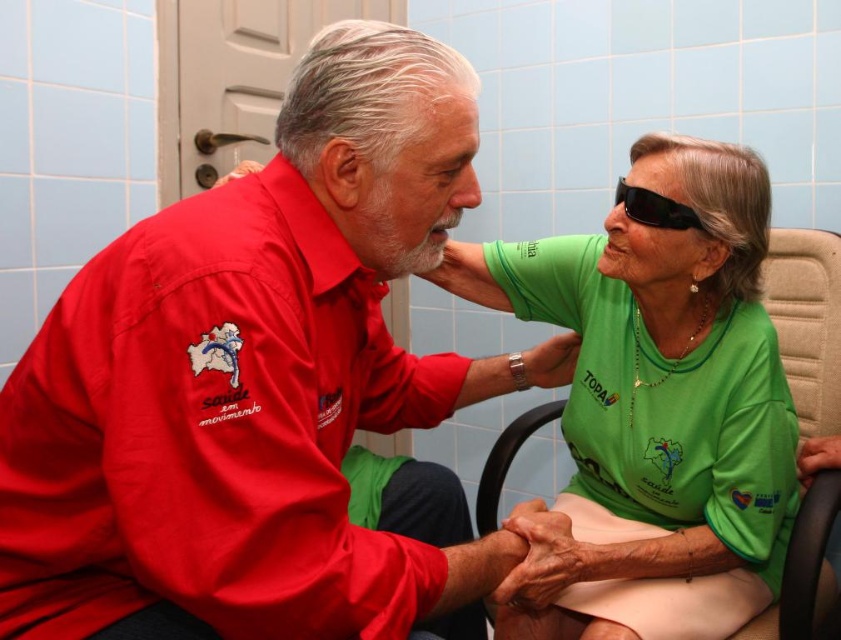
Is matte red shirt at center further to camera compared to green fabric shirt at center?

No, it is in front of green fabric shirt at center.

Who is lower down, matte red shirt at center or green fabric shirt at center?

green fabric shirt at center is below.

Is point (130, 401) in front of point (538, 266)?

Yes.

Find the location of a particular element. matte red shirt at center is located at coordinates (260, 387).

Who is positioned more to the right, matte red shirt at center or black matte forehead at upper center?

Positioned to the right is black matte forehead at upper center.

Who is more forward, (252, 451) or (665, 196)?

Positioned in front is point (252, 451).

The height and width of the screenshot is (640, 841). Find the location of `matte red shirt at center`. matte red shirt at center is located at coordinates (260, 387).

Consider the image. Is green fabric shirt at center thinner than black plastic goggles at upper right?

No.

Measure the distance between green fabric shirt at center and camera.

green fabric shirt at center and camera are 32.53 inches apart.

Is point (723, 252) closer to viewer compared to point (686, 221)?

No, it is behind (686, 221).

Identify the location of green fabric shirt at center. (654, 404).